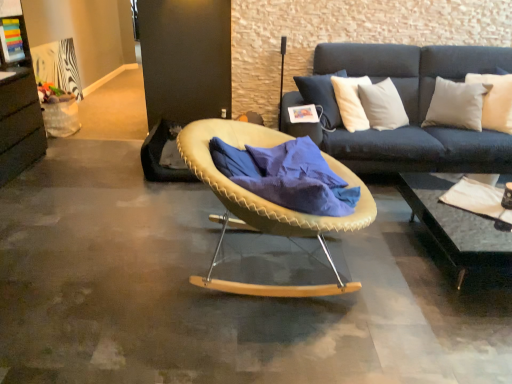
Question: In the image, is black glass coffee table at lower right positioned in front of or behind white soft cushion at upper right?

Choices:
 (A) front
 (B) behind

Answer: (A)

Question: From the image's perspective, is black glass coffee table at lower right located above or below white soft cushion at upper right?

Choices:
 (A) below
 (B) above

Answer: (A)

Question: Which object is the closest to the white soft cushion at upper right?

Choices:
 (A) beige woven chair at center
 (B) black glass coffee table at lower right
 (C) blue soft fabric at center

Answer: (B)

Question: Which of these objects is positioned closest to the beige woven chair at center?

Choices:
 (A) white soft cushion at upper right
 (B) black glass coffee table at lower right
 (C) blue soft fabric at center

Answer: (C)